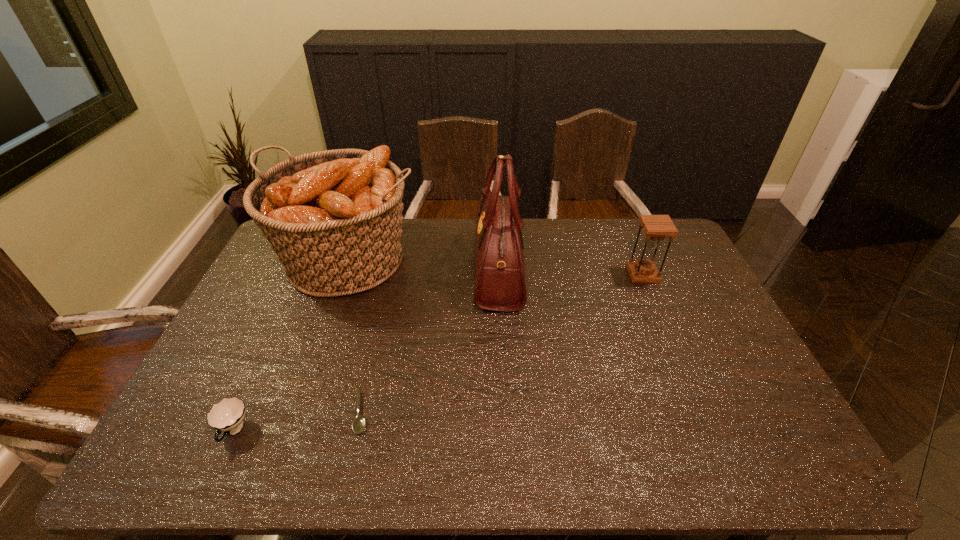
At what (x,y) coordinates should I click in order to perform the action: click on vacant position in the image that satisfies the following two spatial constraints: 1. on the front side of the hourglass; 2. on the left side of the basket. Please return your answer as a coordinate pair (x, y). This screenshot has height=540, width=960. Looking at the image, I should click on (344, 275).

Find the location of a particular element. Image resolution: width=960 pixels, height=540 pixels. free region that satisfies the following two spatial constraints: 1. on the front-facing side of the second object from right to left; 2. on the side of the cup with the handle is located at coordinates (507, 431).

At what (x,y) coordinates should I click in order to perform the action: click on free location that satisfies the following two spatial constraints: 1. on the front-facing side of the third shortest object; 2. on the right side of the handbag. Please return your answer as a coordinate pair (x, y). Looking at the image, I should click on (499, 275).

Where is `blank area in the image that satisfies the following two spatial constraints: 1. on the front-facing side of the handbag; 2. on the front side of the soupspoon`? This screenshot has height=540, width=960. blank area in the image that satisfies the following two spatial constraints: 1. on the front-facing side of the handbag; 2. on the front side of the soupspoon is located at coordinates (506, 412).